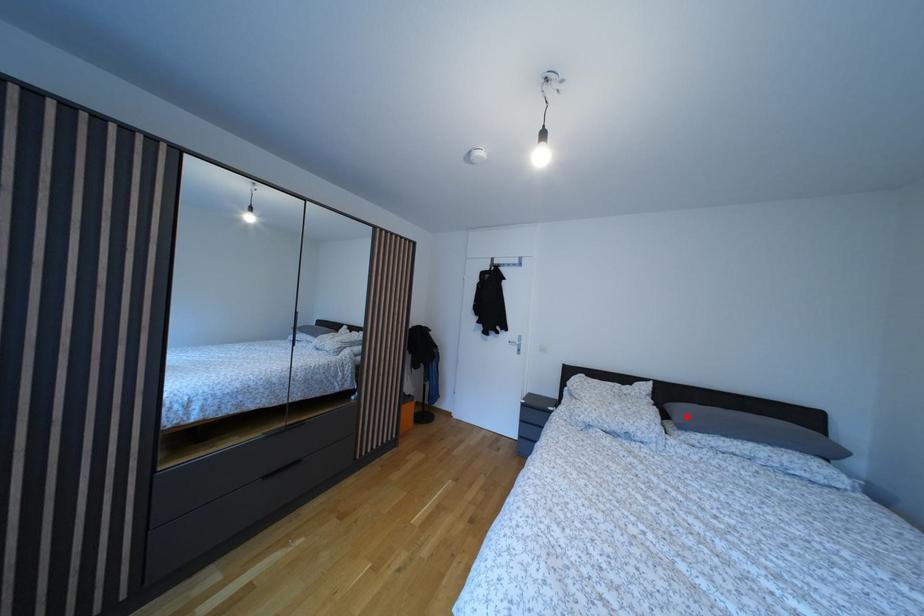
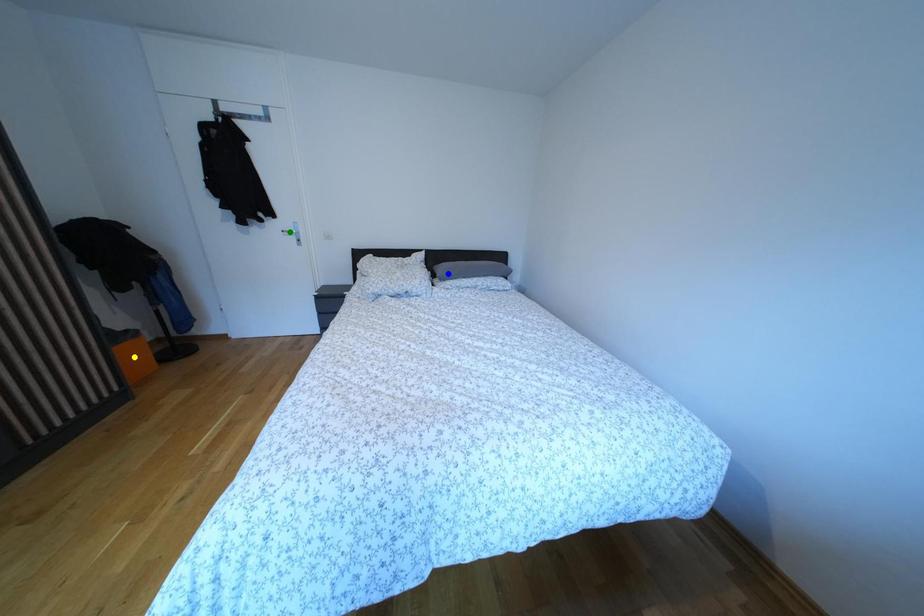
Question: I am providing you with two images of the same scene from different viewpoints. A red point is marked on the first image. You are given multiple points on the second image. In image 2, which mark is for the same physical point as the one in image 1?

Choices:
 (A) green point
 (B) yellow point
 (C) blue point

Answer: (C)